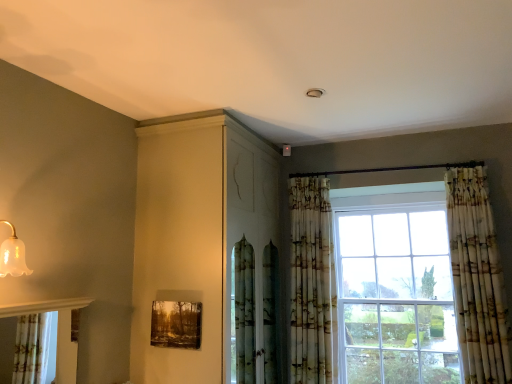
Question: From a real-world perspective, is wooden textured frame at lower center positioned above or below matte white cabinet at upper center?

Choices:
 (A) above
 (B) below

Answer: (B)

Question: Visually, is wooden textured frame at lower center positioned to the left or to the right of matte white cabinet at upper center?

Choices:
 (A) right
 (B) left

Answer: (B)

Question: Which object is positioned closest to the printed fabric curtain at right, which is the 2th curtain in left-to-right order?

Choices:
 (A) matte white cabinet at upper center
 (B) wooden textured frame at lower center
 (C) translucent glass bell at upper left
 (D) printed fabric curtain at center, the 1th curtain positioned from the left

Answer: (D)

Question: Which is farther from the translucent glass bell at upper left?

Choices:
 (A) wooden textured frame at lower center
 (B) printed fabric curtain at center, the 1th curtain positioned from the left
 (C) matte white cabinet at upper center
 (D) printed fabric curtain at right, positioned as the first curtain in right-to-left order

Answer: (D)